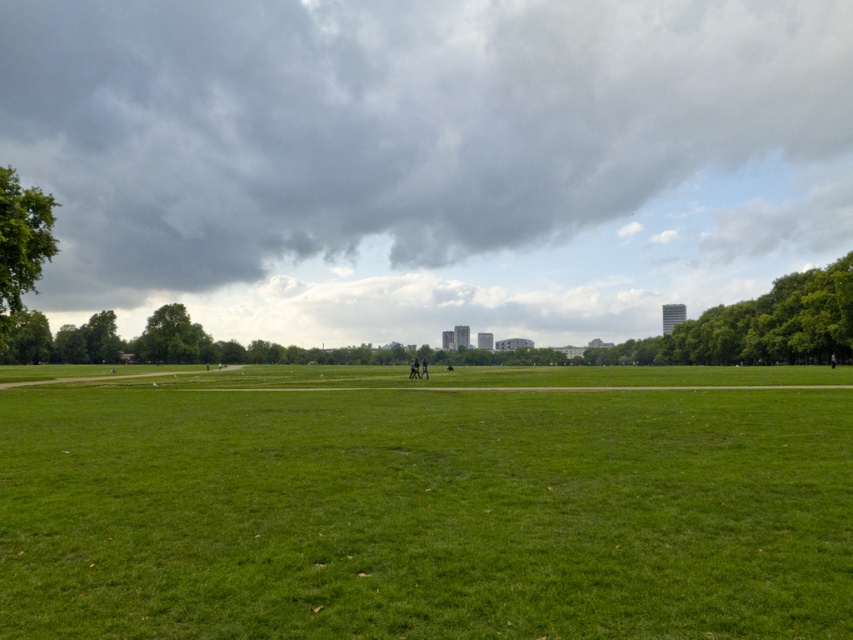
Question: Is green leafy tree at right thinner than green leafy tree at left?

Choices:
 (A) yes
 (B) no

Answer: (B)

Question: Which of these objects is positioned farthest from the green grassy field at center?

Choices:
 (A) dark gray cloud at upper center
 (B) green leafy tree at center-left

Answer: (A)

Question: Estimate the real-world distances between objects in this image. Which object is closer to the green leafy tree at left?

Choices:
 (A) green leafy tree at right
 (B) dark gray cloud at upper center
 (C) green grassy field at center

Answer: (C)

Question: Which point appears farthest from the camera in this image?

Choices:
 (A) (49, 252)
 (B) (795, 314)
 (C) (194, 323)
 (D) (308, 220)

Answer: (D)

Question: Is dark gray cloud at upper center wider than green leafy tree at center-left?

Choices:
 (A) yes
 (B) no

Answer: (A)

Question: Is green leafy tree at left above green leafy tree at center-left?

Choices:
 (A) no
 (B) yes

Answer: (B)